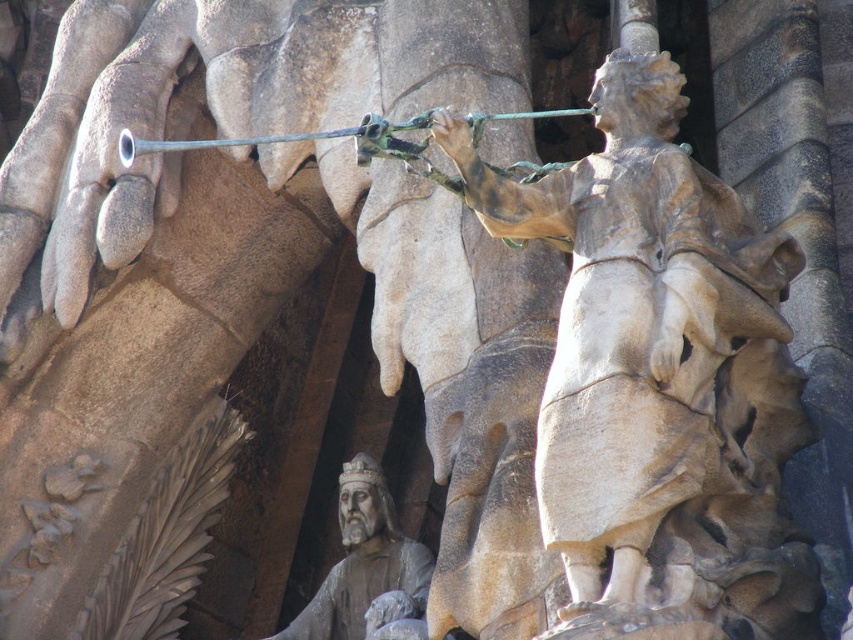
Question: Does stone statue at center have a larger size compared to smooth stone statue at lower center?

Choices:
 (A) no
 (B) yes

Answer: (B)

Question: Which of the following is the farthest from the observer?

Choices:
 (A) stone statue at center
 (B) smooth stone statue at lower center

Answer: (B)

Question: Which object appears closest to the camera in this image?

Choices:
 (A) stone statue at center
 (B) smooth stone statue at lower center

Answer: (A)

Question: Can you confirm if stone statue at center is wider than smooth stone statue at lower center?

Choices:
 (A) no
 (B) yes

Answer: (B)

Question: Does stone statue at center appear on the left side of smooth stone statue at lower center?

Choices:
 (A) yes
 (B) no

Answer: (B)

Question: Among these points, which one is nearest to the camera?

Choices:
 (A) (595, 442)
 (B) (344, 531)

Answer: (A)